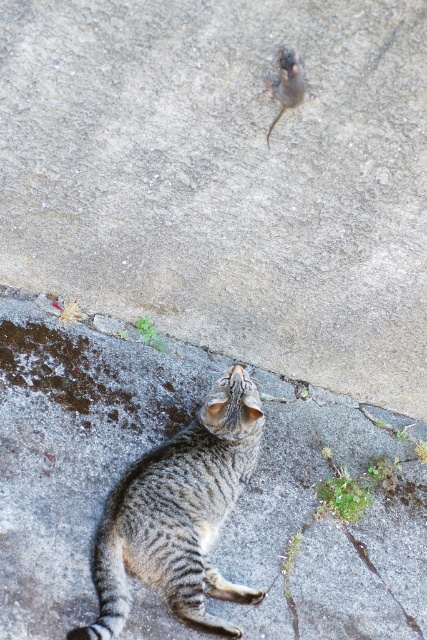
Can you confirm if gray striped cat at center is thinner than gray stone crack at lower right?

In fact, gray striped cat at center might be wider than gray stone crack at lower right.

You are a GUI agent. You are given a task and a screenshot of the screen. Output one action in this format:
    pyautogui.click(x=<x>, y=<y>)
    Task: Click on the gray striped cat at center
    The image size is (427, 640).
    Given the screenshot: What is the action you would take?
    pyautogui.click(x=178, y=513)

Can you confirm if gray concrete at lower center is wider than gray concrete pavement at lower center?

No.

How far apart are gray concrete at lower center and gray concrete pavement at lower center?

20.53 inches

Where is `gray concrete at lower center`? The image size is (427, 640). gray concrete at lower center is located at coordinates (227, 177).

Is gray concrete at lower center further to camera compared to gray stone crack at lower right?

No, gray concrete at lower center is in front of gray stone crack at lower right.

Between point (208, 186) and point (353, 545), which one is positioned behind?

The point (353, 545) is more distant.

Where is `gray concrete at lower center`? gray concrete at lower center is located at coordinates 227,177.